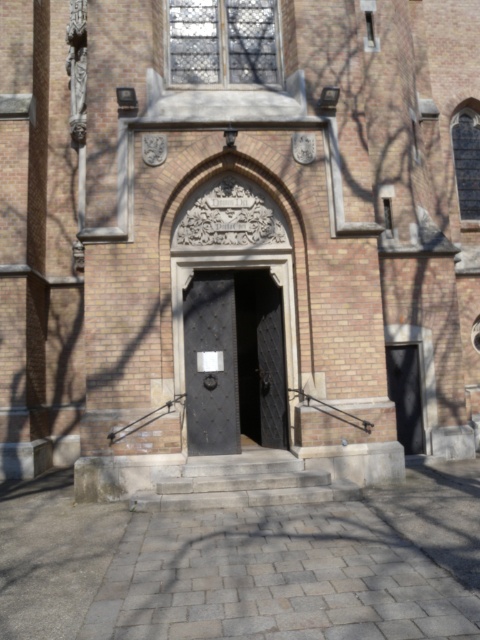
Can you confirm if black textured door at center is positioned to the right of black matte door at right?

No, black textured door at center is not to the right of black matte door at right.

Is black textured door at center positioned before black matte door at right?

Yes, black textured door at center is in front of black matte door at right.

Who is more distant from viewer, (202,349) or (398,433)?

Positioned behind is point (398,433).

The width and height of the screenshot is (480, 640). I want to click on black textured door at center, so click(211, 364).